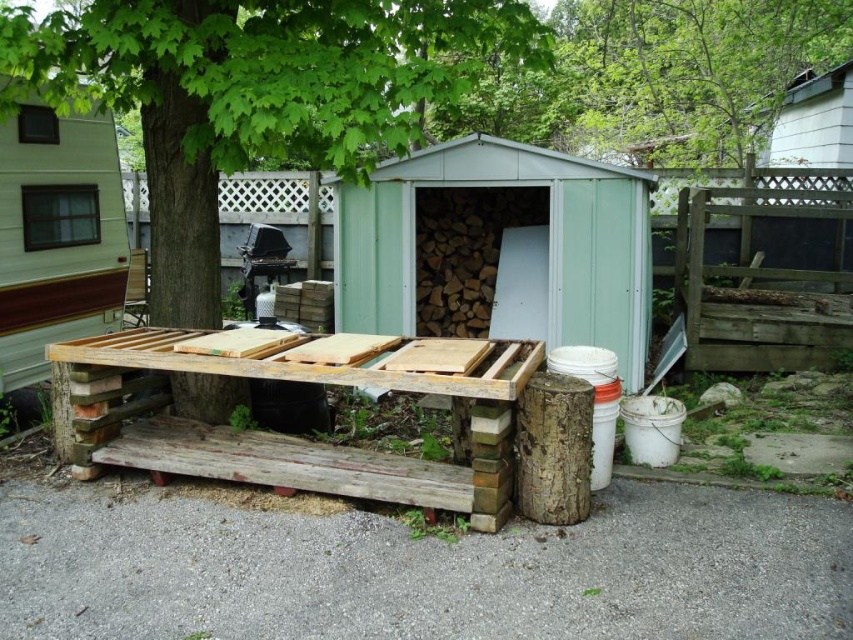
Based on the image, what object is located at the coordinates point (x=253, y=93)?

The green leafy tree at center is located at point (x=253, y=93).

What are the coordinates of the green leafy tree at upper center in the image?

The green leafy tree at upper center is located at coordinates point [689,68].

You are standing in the backyard looking at the shed and the trailer. There are two points marked in the scene, one at coordinates point (618, 230) and the other at point (115, 445). Which point is closer to you?

Point (618, 230) is further to the viewer than point (115, 445), so the point closer to you is point (115, 445).